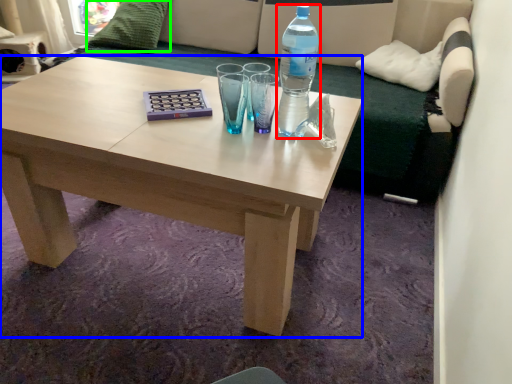
Question: Considering the real-world distances, which object is closest to bottle (highlighted by a red box)? coffee table (highlighted by a blue box) or pillow (highlighted by a green box).

Choices:
 (A) coffee table
 (B) pillow

Answer: (A)